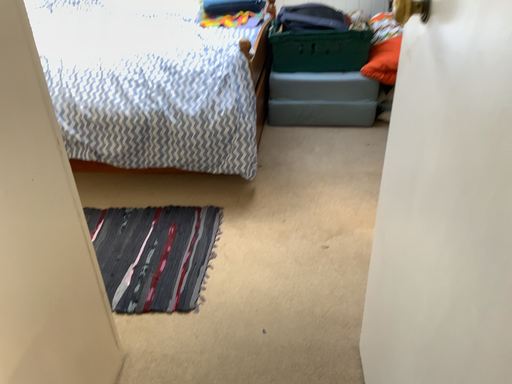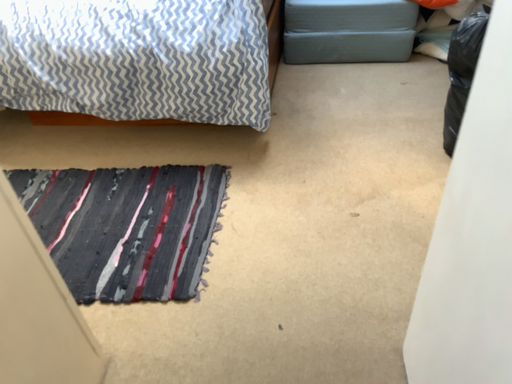
Question: Which way did the camera rotate in the video?

Choices:
 (A) rotated downward
 (B) rotated upward

Answer: (A)